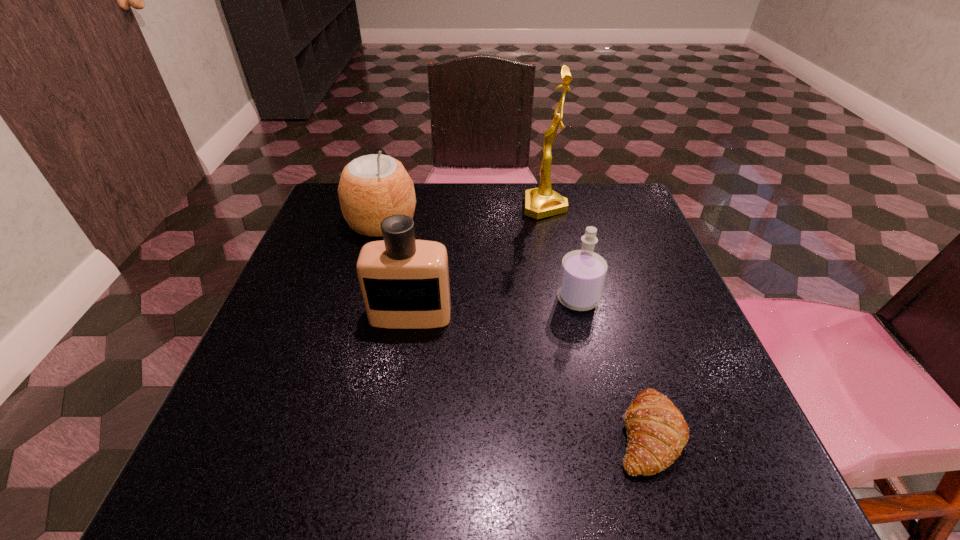
Locate an element on the screen. The image size is (960, 540). object that is positioned at the near right corner is located at coordinates (657, 433).

Identify the location of vacant space at the far edge of the desktop. (485, 217).

What are the coordinates of `vacant point at the near edge` in the screenshot? It's located at (591, 500).

Locate an element on the screen. free space at the left edge of the desktop is located at coordinates (318, 242).

This screenshot has width=960, height=540. I want to click on vacant region at the right edge, so click(x=642, y=333).

Locate an element on the screen. Image resolution: width=960 pixels, height=540 pixels. vacant space at the far left corner of the desktop is located at coordinates (334, 203).

In the image, there is a desktop. Identify the location of vacant space at the near left corner. (299, 492).

In the image, there is a desktop. Where is `vacant space at the far right corner`? This screenshot has width=960, height=540. vacant space at the far right corner is located at coordinates (612, 225).

The image size is (960, 540). What are the coordinates of `free space at the near right corner` in the screenshot? It's located at (693, 498).

Find the location of a particular element. Image resolution: width=960 pixels, height=540 pixels. unoccupied position between the crescent roll and the left perfume is located at coordinates (529, 374).